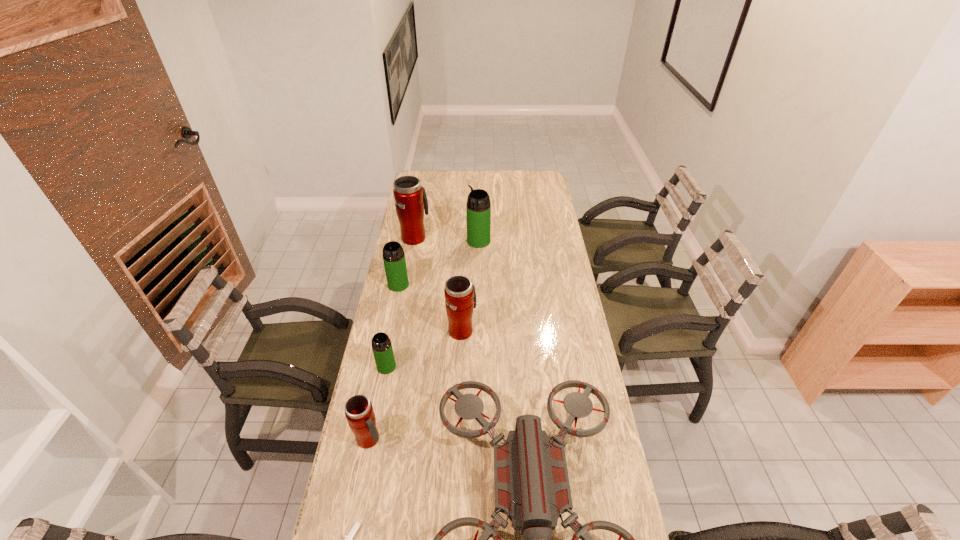
Locate an element on the screen. This screenshot has width=960, height=540. vacant area situated 0.390m on the side with the handle of the fifth nearest object is located at coordinates (465, 255).

Identify the location of free space located from the spout of the second nearest thermos bottle. (362, 496).

At what (x,y) coordinates should I click in order to perform the action: click on vacant space located on the side with the handle of the smallest red thermos bottle. Please return your answer as a coordinate pair (x, y). The height and width of the screenshot is (540, 960). Looking at the image, I should click on (486, 439).

Where is `vacant space at the right edge`? Image resolution: width=960 pixels, height=540 pixels. vacant space at the right edge is located at coordinates (542, 210).

Find the location of `free space at the far right corner of the desktop`. free space at the far right corner of the desktop is located at coordinates (540, 172).

At what (x,y) coordinates should I click in order to perform the action: click on free space that is in between the fifth farthest object and the farthest red thermos bottle. Please return your answer as a coordinate pair (x, y). The height and width of the screenshot is (540, 960). Looking at the image, I should click on (400, 302).

This screenshot has height=540, width=960. I want to click on empty space between the second farthest red thermos bottle and the smallest green thermos bottle, so click(x=424, y=348).

Where is `unoccupied position between the smallest green thermos bottle and the second biggest green thermos bottle`? This screenshot has width=960, height=540. unoccupied position between the smallest green thermos bottle and the second biggest green thermos bottle is located at coordinates (393, 326).

Locate an element on the screen. unoccupied area between the fourth nearest object and the nearest red thermos bottle is located at coordinates (378, 403).

Find the location of a particular element. This screenshot has width=960, height=540. free space between the nearest red thermos bottle and the second nearest thermos bottle is located at coordinates (378, 403).